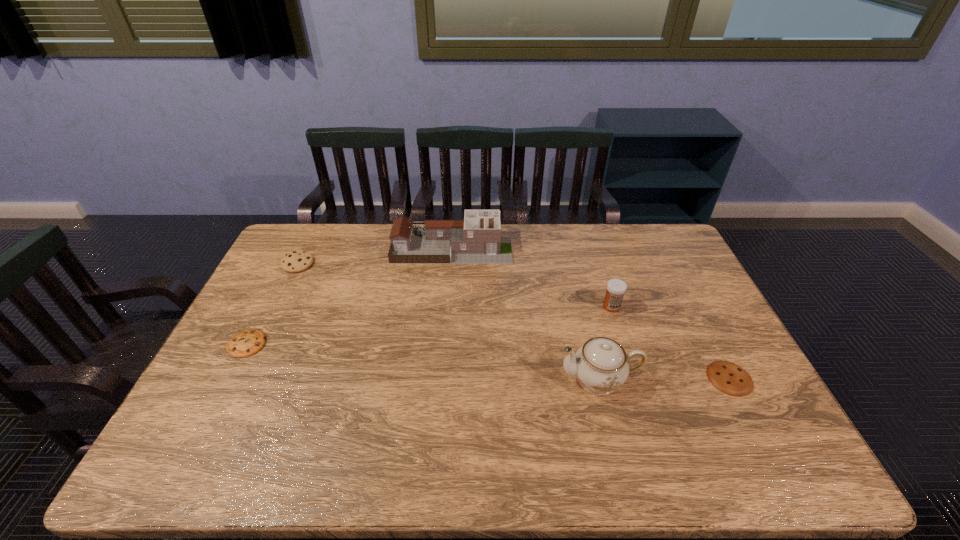
What are the coordinates of `object present at the far left corner` in the screenshot? It's located at (297, 261).

Locate an element on the screen. vacant area at the far edge of the desktop is located at coordinates [x=362, y=249].

What are the coordinates of `blank space at the near edge of the desktop` in the screenshot? It's located at (649, 456).

The image size is (960, 540). In order to click on free space at the left edge of the desktop in this screenshot , I will do `click(289, 288)`.

Find the location of `blank space at the right edge of the desktop`. blank space at the right edge of the desktop is located at coordinates (734, 402).

Find the location of a particular element. The image size is (960, 540). vacant space at the far left corner of the desktop is located at coordinates click(x=330, y=235).

Where is `free point between the farthest cookie and the chinaware`? The image size is (960, 540). free point between the farthest cookie and the chinaware is located at coordinates (448, 322).

Locate an element on the screen. free area in between the fourth tallest object and the rightmost cookie is located at coordinates (514, 321).

At what (x,y) coordinates should I click in order to perform the action: click on vacant area that lies between the rightmost cookie and the tallest cookie. Please return your answer as a coordinate pair (x, y). Looking at the image, I should click on (514, 321).

Locate an element on the screen. This screenshot has width=960, height=540. vacant area that lies between the chinaware and the third nearest object is located at coordinates (423, 362).